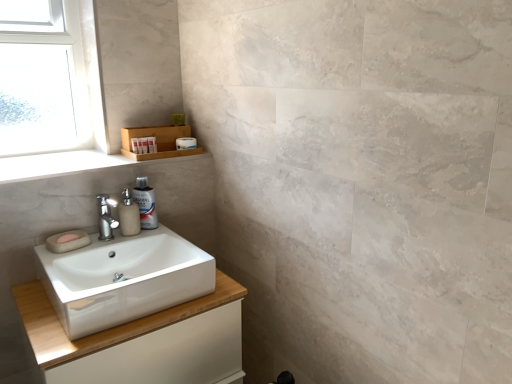
Identify the location of free space in front of white matte toilet paper at upper center. This screenshot has height=384, width=512. (165, 157).